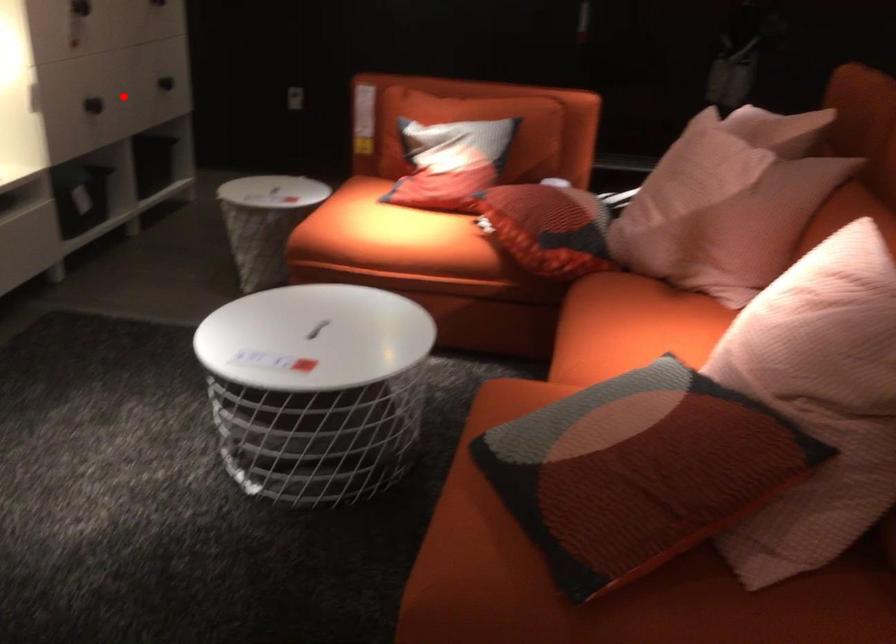
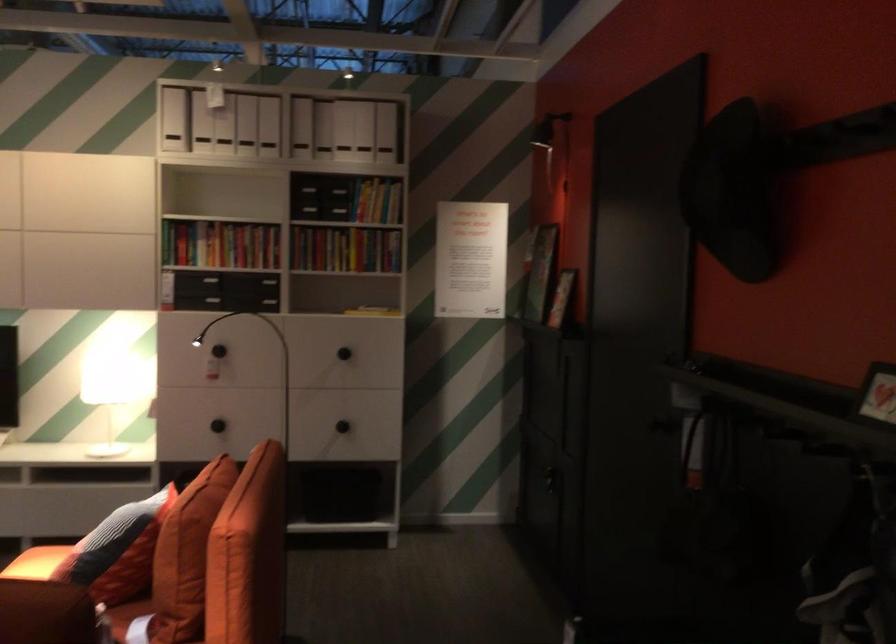
Locate, in the second image, the point that corresponds to the highlighted location in the first image.

(218, 426)